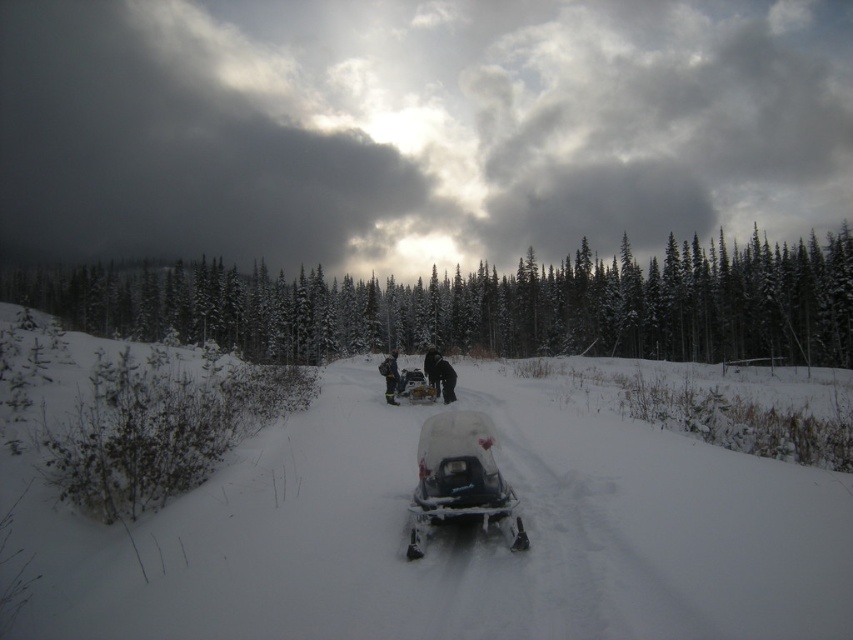
Question: Is matte black snowmobile at center thinner than black fabric jacket at center?

Choices:
 (A) yes
 (B) no

Answer: (B)

Question: Is matte black snowmobile at center thinner than black fabric jacket at center?

Choices:
 (A) yes
 (B) no

Answer: (B)

Question: Which point is closer to the camera?

Choices:
 (A) black fabric jacket at center
 (B) dark blue snowsuit at center
 (C) white powdery snow at center

Answer: (C)

Question: Does white matte snowmobile at center have a larger size compared to dark gray fabric backpack at center?

Choices:
 (A) yes
 (B) no

Answer: (A)

Question: Which object appears closest to the camera in this image?

Choices:
 (A) matte black snowmobile at center
 (B) dark gray fabric backpack at center
 (C) white powdery snow at center
 (D) dark blue snowsuit at center

Answer: (C)

Question: Which point is closer to the camera?

Choices:
 (A) black fabric jacket at center
 (B) white matte snowmobile at center
 (C) white powdery snow at center
 (D) matte black snowmobile at center

Answer: (C)